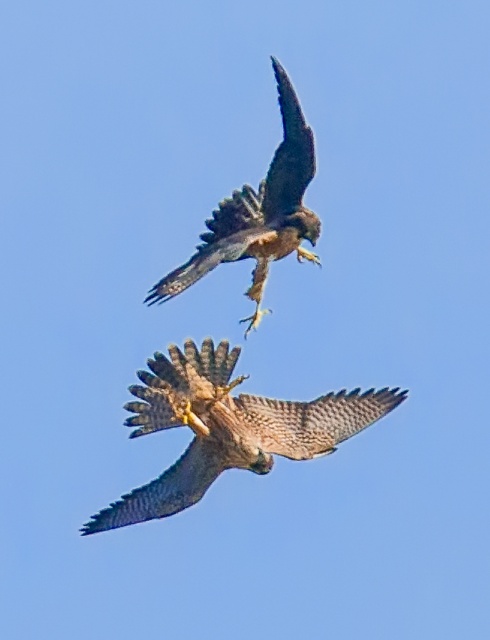
You are a wildlife photographer trying to capture a closeup of the brown speckled feathers at center. Based on the coordinates given, where should you aim your camera lens to ensure the feathers are centered in your shot?

The brown speckled feathers at center are located at coordinates point (226, 428), so you should aim your camera lens at that exact coordinate point to center them in your shot.

You are an ornithologist observing two birds in the sky. You notice the brown speckled feathers at center and the brown feathered eagle at upper center. Which bird has a smaller wingspan?

The brown speckled feathers at center has a smaller wingspan than the brown feathered eagle at upper center because it is shorter.

You are a birdwatcher observing two birds in the sky. You see the brown speckled feathers at center and the brown feathered eagle at upper center. Which of these two birds appears bigger in size?

The brown speckled feathers at center appears larger in size compared to the brown feathered eagle at upper center.